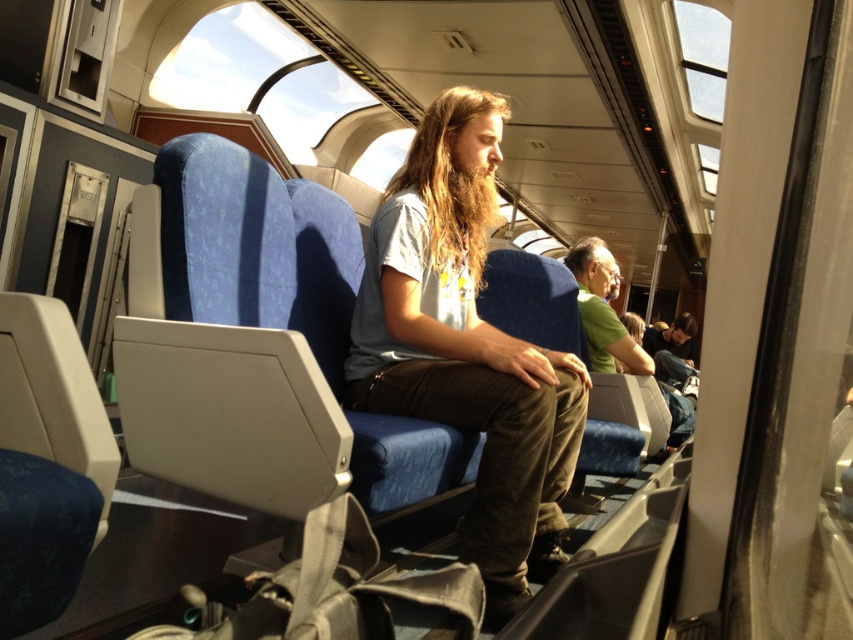
Is point (558, 403) positioned before point (595, 346)?

Yes, point (558, 403) is in front of point (595, 346).

Who is higher up, matte gray shirt at center or green matte shirt at center?

green matte shirt at center is above.

You are a GUI agent. You are given a task and a screenshot of the screen. Output one action in this format:
    pyautogui.click(x=<x>, y=<y>)
    Task: Click on the matte gray shirt at center
    This screenshot has width=853, height=640.
    Given the screenshot: What is the action you would take?
    pyautogui.click(x=466, y=348)

I want to click on matte gray shirt at center, so click(x=466, y=348).